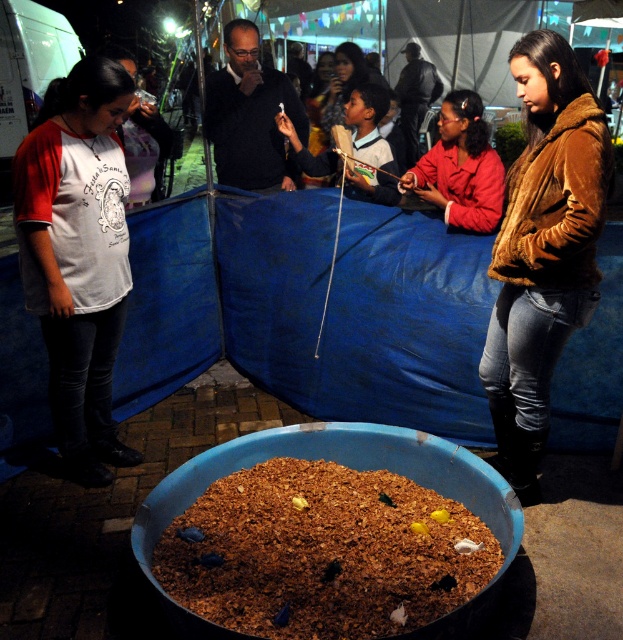
You are at the event and see both the brown crumbly food at center and the brown fuzzy jacket at lower right. Which object is located to the left of the other?

The brown crumbly food at center is positioned on the left side of brown fuzzy jacket at lower right.

You are at the event and want to move from the white jersey at left to the brown fuzzy jacket at lower right. Which direction should you move?

To move from the white jersey at left to the brown fuzzy jacket at lower right, you should move to the right since the brown fuzzy jacket at lower right is positioned to the right of the white jersey at left.

You are at the event and see both the brown crumbly food at center and the matte brown jacket at center. Which item is positioned to the left when viewed from your perspective?

The brown crumbly food at center is to the left of the matte brown jacket at center, so the brown crumbly food at center is positioned to the left.